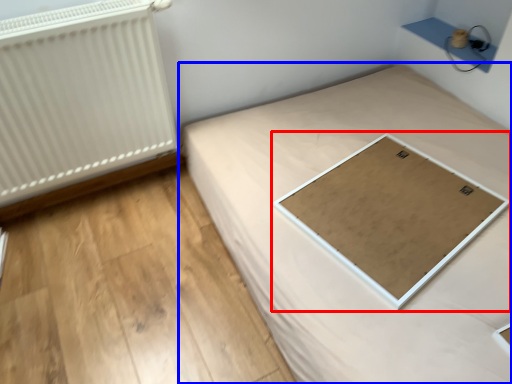
Question: Which object appears farthest to the camera in this image, table (highlighted by a red box) or bed (highlighted by a blue box)?

Choices:
 (A) table
 (B) bed

Answer: (A)